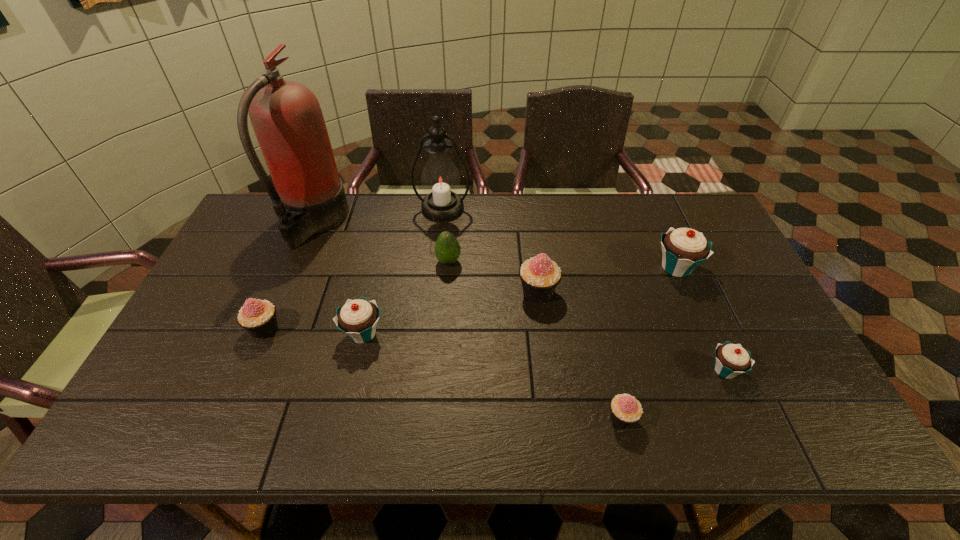
Locate an element on the screen. free space between the second tallest object and the fire extinguisher is located at coordinates (379, 215).

Find the location of a particular element. The height and width of the screenshot is (540, 960). vacant area that lies between the second pink cupcake from left to right and the second tallest object is located at coordinates (491, 250).

Identify the location of vacant space that is in between the second nearest teal cupcake and the farthest teal cupcake. (519, 301).

You are a GUI agent. You are given a task and a screenshot of the screen. Output one action in this format:
    pyautogui.click(x=<x>, y=<y>)
    Task: Click on the blank region between the biggest teal cupcake and the third cupcake from left to right
    This screenshot has height=540, width=960.
    Given the screenshot: What is the action you would take?
    pyautogui.click(x=607, y=280)

You are a GUI agent. You are given a task and a screenshot of the screen. Output one action in this format:
    pyautogui.click(x=<x>, y=<y>)
    Task: Click on the free space that is in between the second pink cupcake from right to left and the fire extinguisher
    This screenshot has height=540, width=960.
    Given the screenshot: What is the action you would take?
    pyautogui.click(x=426, y=257)

You are a GUI agent. You are given a task and a screenshot of the screen. Output one action in this format:
    pyautogui.click(x=<x>, y=<y>)
    Task: Click on the object that is the eighth closest to the rightmost pink cupcake
    
    Given the screenshot: What is the action you would take?
    pyautogui.click(x=287, y=119)

Find the location of a particular element. Image resolution: width=960 pixels, height=540 pixels. object identified as the seventh closest to the second nearest cupcake is located at coordinates (287, 119).

What are the coordinates of `cupcake that is the nearest to the third object from right to left` in the screenshot? It's located at (731, 360).

The width and height of the screenshot is (960, 540). Identify the location of cupcake that stands as the fourth closest to the farthest pink cupcake. (731, 360).

Locate which pink cupcake ranks second in proximity to the smallest teal cupcake. Please provide its 2D coordinates. Your answer should be formatted as a tuple, i.e. [(x, y)], where the tuple contains the x and y coordinates of a point satisfying the conditions above.

[(540, 276)]